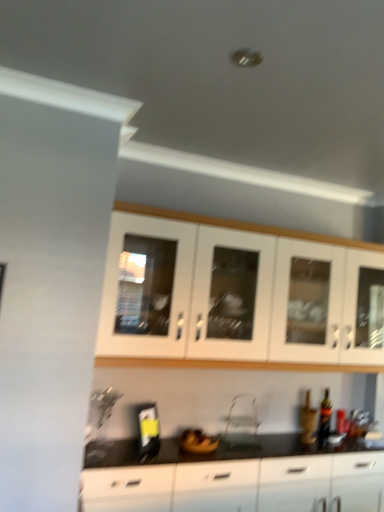
Question: From the image's perspective, is matte glass bottle at lower right above or below clear plastic folding chair at center?

Choices:
 (A) above
 (B) below

Answer: (B)

Question: Considering the positions of matte glass bottle at lower right and clear plastic folding chair at center in the image, is matte glass bottle at lower right taller or shorter than clear plastic folding chair at center?

Choices:
 (A) tall
 (B) short

Answer: (A)

Question: Estimate the real-world distances between objects in this image. Which object is closer to the black glossy cabinet at lower center, the second cabinetry in the top-to-bottom sequence?

Choices:
 (A) matte glass bottle at lower right
 (B) clear plastic folding chair at center
 (C) white glass cabinet at upper center, placed as the second cabinetry when sorted from bottom to top

Answer: (B)

Question: Based on their relative distances, which object is farther from the white glass cabinet at upper center, which is the 1th cabinetry from top to bottom?

Choices:
 (A) clear plastic folding chair at center
 (B) black glossy cabinet at lower center, the 1th cabinetry when ordered from bottom to top
 (C) matte glass bottle at lower right

Answer: (C)